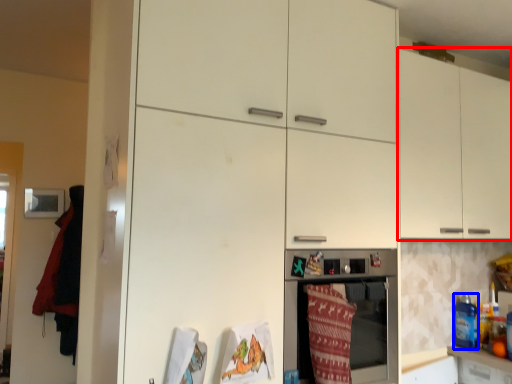
Question: Which of the following is the farthest to the observer, cabinetry (highlighted by a red box) or beverage (highlighted by a blue box)?

Choices:
 (A) cabinetry
 (B) beverage

Answer: (B)